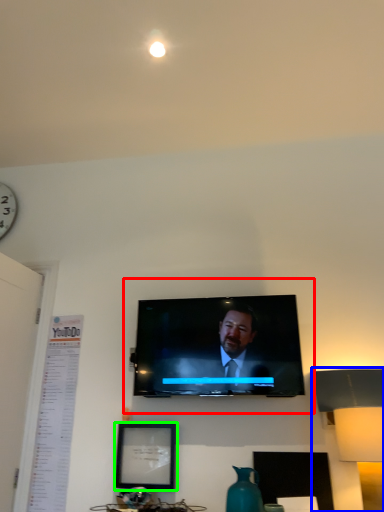
Question: Estimate the real-world distances between objects in this image. Which object is closer to tv show (highlighted by a red box), table lamp (highlighted by a blue box) or picture frame (highlighted by a green box)?

Choices:
 (A) table lamp
 (B) picture frame

Answer: (B)